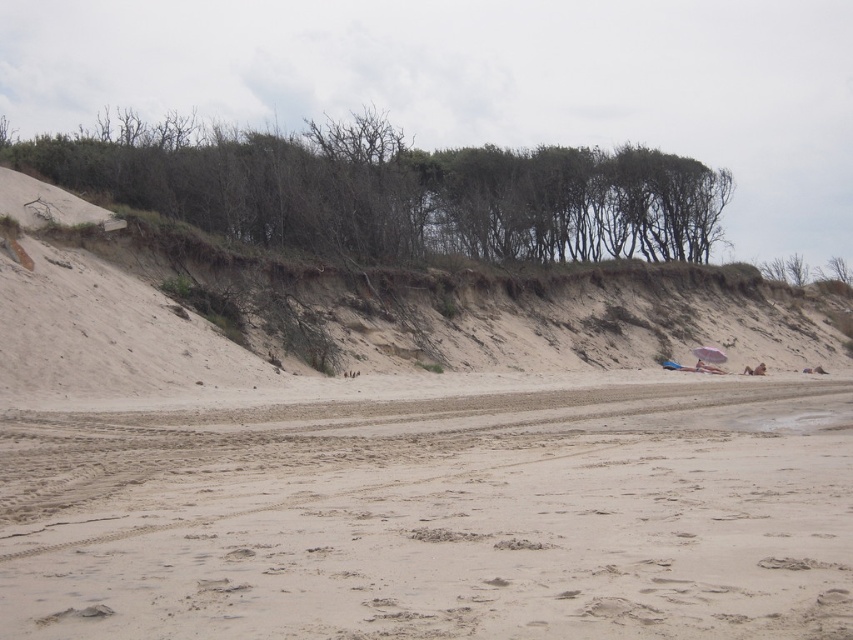
Question: From the image, what is the correct spatial relationship of light beige sand at center in relation to green leafy trees at upper center?

Choices:
 (A) left
 (B) right

Answer: (B)

Question: Observing the image, what is the correct spatial positioning of light beige sand at center in reference to green leafy trees at upper center?

Choices:
 (A) above
 (B) below

Answer: (B)

Question: Does light beige sand at center have a greater width compared to green leafy trees at upper center?

Choices:
 (A) yes
 (B) no

Answer: (B)

Question: Estimate the real-world distances between objects in this image. Which object is closer to the light beige sand at center?

Choices:
 (A) green leafy trees at upper center
 (B) brown sandy hillside at upper center

Answer: (B)

Question: Which of the following is the farthest from the observer?

Choices:
 (A) (689, 257)
 (B) (759, 404)

Answer: (A)

Question: Among these points, which one is farthest from the camera?

Choices:
 (A) (387, 227)
 (B) (204, 371)

Answer: (A)